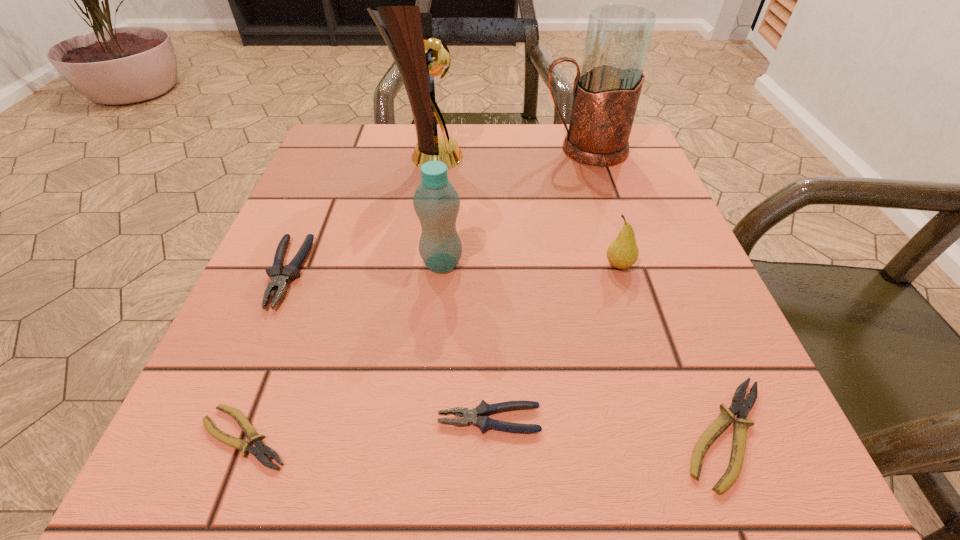
Locate an element on the screen. The width and height of the screenshot is (960, 540). object that is at the near left corner is located at coordinates (260, 450).

The width and height of the screenshot is (960, 540). I want to click on object that is at the far right corner, so click(x=606, y=91).

What are the coordinates of `object that is at the near right corner` in the screenshot? It's located at (739, 405).

Locate an element on the screen. Image resolution: width=960 pixels, height=540 pixels. free point at the far edge is located at coordinates (561, 138).

Where is `free space at the near edge of the desktop`? The image size is (960, 540). free space at the near edge of the desktop is located at coordinates (371, 451).

The width and height of the screenshot is (960, 540). In the image, there is a desktop. Identify the location of vacant area at the left edge. (326, 394).

Locate an element on the screen. The width and height of the screenshot is (960, 540). vacant region at the right edge of the desktop is located at coordinates (682, 258).

In the image, there is a desktop. Identify the location of free region at the far left corner. The height and width of the screenshot is (540, 960). (352, 150).

The image size is (960, 540). In the image, there is a desktop. What are the coordinates of `vacant space at the near left corner` in the screenshot? It's located at pyautogui.click(x=272, y=438).

At what (x,y) coordinates should I click in order to perform the action: click on free space at the far right corner. Please return your answer as a coordinate pair (x, y). The height and width of the screenshot is (540, 960). Looking at the image, I should click on (612, 180).